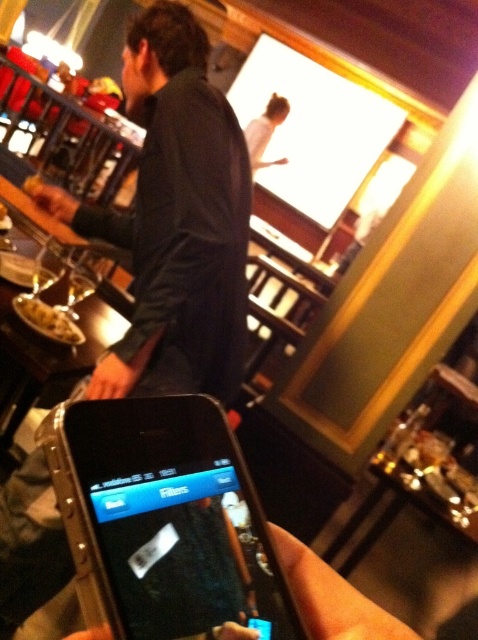
Question: Which of these objects is positioned closest to the matte black hand at center?

Choices:
 (A) matte brown bread at lower left
 (B) black plastic smartphone at lower center

Answer: (A)

Question: Which object appears farthest from the camera in this image?

Choices:
 (A) matte black hand at center
 (B) black plastic smartphone at lower center
 (C) matte brown bread at lower left

Answer: (A)

Question: Does black plastic smartphone at lower center lie behind matte black hand at center?

Choices:
 (A) no
 (B) yes

Answer: (A)

Question: Among these objects, which one is nearest to the camera?

Choices:
 (A) matte brown bread at lower left
 (B) black plastic smartphone at lower center

Answer: (B)

Question: Is matte brown bread at lower left above matte black hand at center?

Choices:
 (A) no
 (B) yes

Answer: (A)

Question: Does black plastic smartphone at lower center have a larger size compared to matte black hand at center?

Choices:
 (A) yes
 (B) no

Answer: (B)